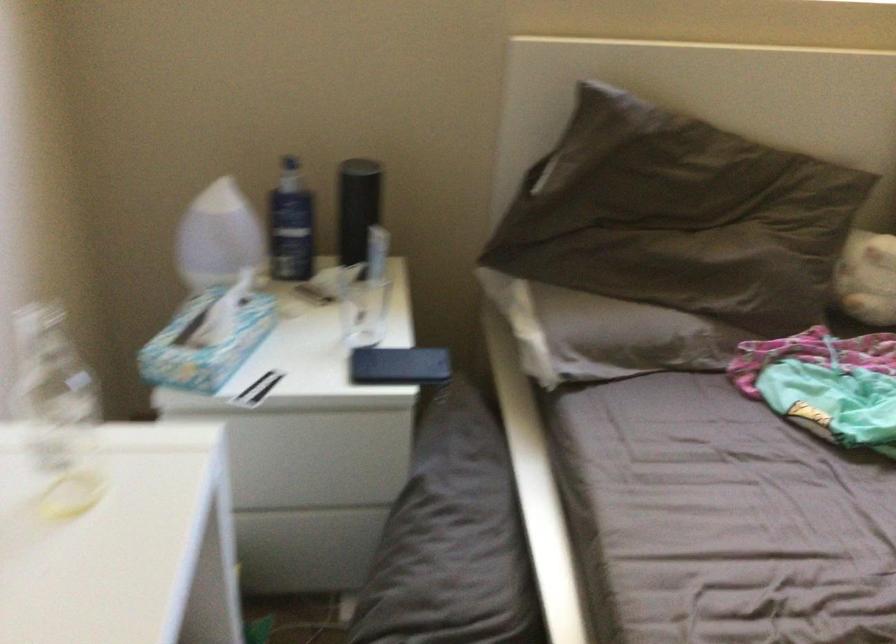
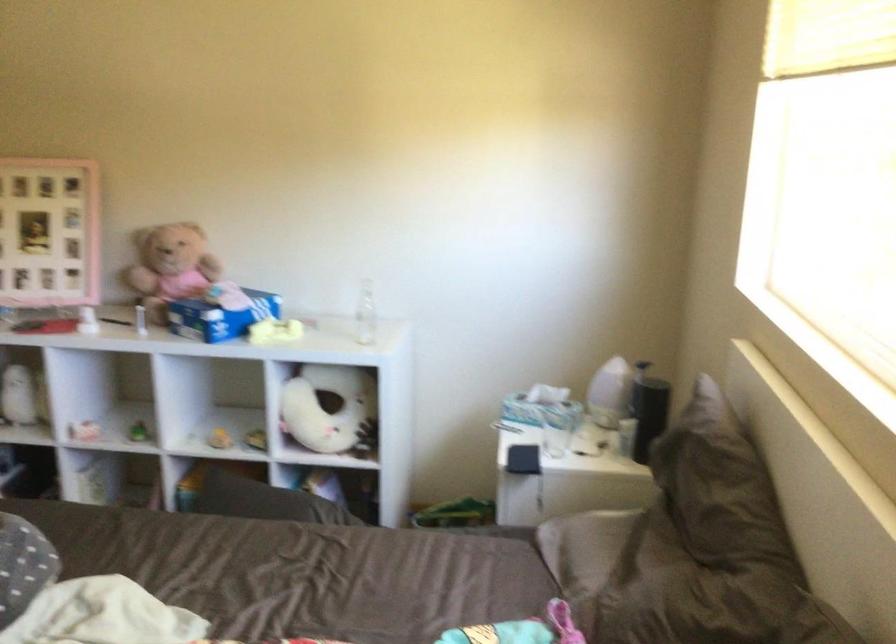
In the second image, find the point that corresponds to pixel 418 364 in the first image.

(522, 459)